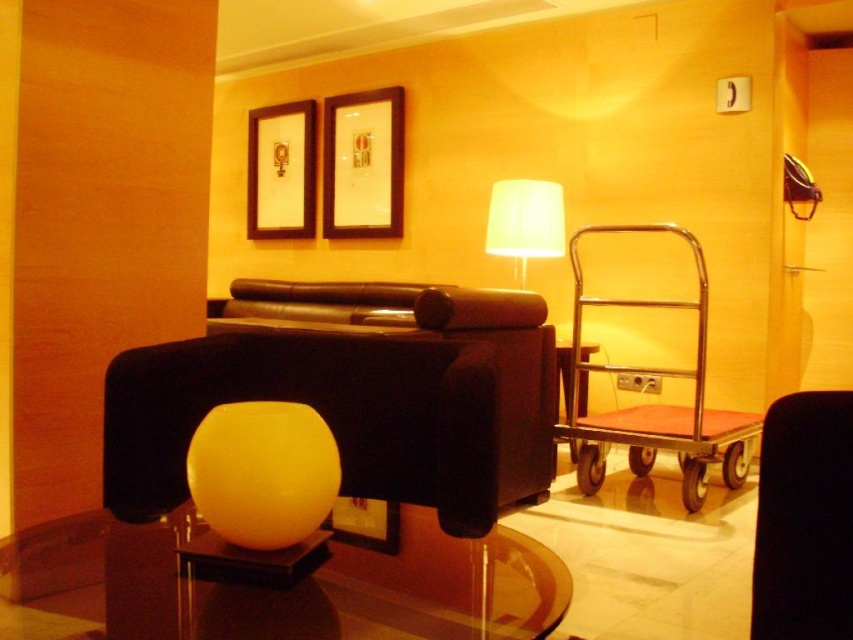
Where is `transparent glass table at center`? This screenshot has height=640, width=853. transparent glass table at center is located at coordinates (276, 592).

In the scene shown: Is transparent glass table at center below wooden picture frame at upper center?

Yes, transparent glass table at center is below wooden picture frame at upper center.

Is point (463, 621) behind point (296, 176)?

No, it is in front of (296, 176).

Locate an element on the screen. The height and width of the screenshot is (640, 853). transparent glass table at center is located at coordinates [x=276, y=592].

Is wooden picture frame at upper center further to the viewer compared to white fabric lampshade at upper center?

Yes, wooden picture frame at upper center is further from the viewer.

Find the location of a particular element. The height and width of the screenshot is (640, 853). wooden picture frame at upper center is located at coordinates (281, 170).

Does transparent glass table at center lie in front of white fabric lampshade at upper center?

Yes, transparent glass table at center is in front of white fabric lampshade at upper center.

Can you confirm if transparent glass table at center is thinner than white fabric lampshade at upper center?

Incorrect, transparent glass table at center's width is not less than white fabric lampshade at upper center's.

Is point (398, 570) positioned before point (535, 195)?

Yes, point (398, 570) is in front of point (535, 195).

I want to click on transparent glass table at center, so click(x=276, y=592).